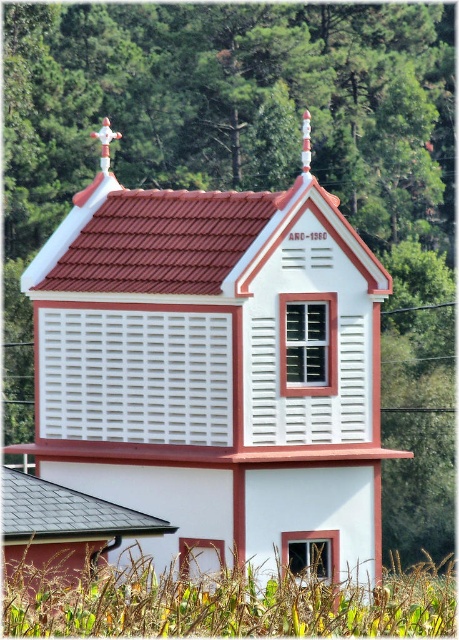
Question: Which point is closer to the camera taking this photo?

Choices:
 (A) (16, 500)
 (B) (319, 269)

Answer: (A)

Question: From the image, what is the correct spatial relationship of white louvered chapel at center in relation to gray slate roof at lower left?

Choices:
 (A) right
 (B) left

Answer: (A)

Question: Which object appears closest to the camera in this image?

Choices:
 (A) gray slate roof at lower left
 (B) white louvered chapel at center

Answer: (A)

Question: Does white louvered chapel at center appear over gray slate roof at lower left?

Choices:
 (A) yes
 (B) no

Answer: (A)

Question: Does white louvered chapel at center appear on the right side of gray slate roof at lower left?

Choices:
 (A) yes
 (B) no

Answer: (A)